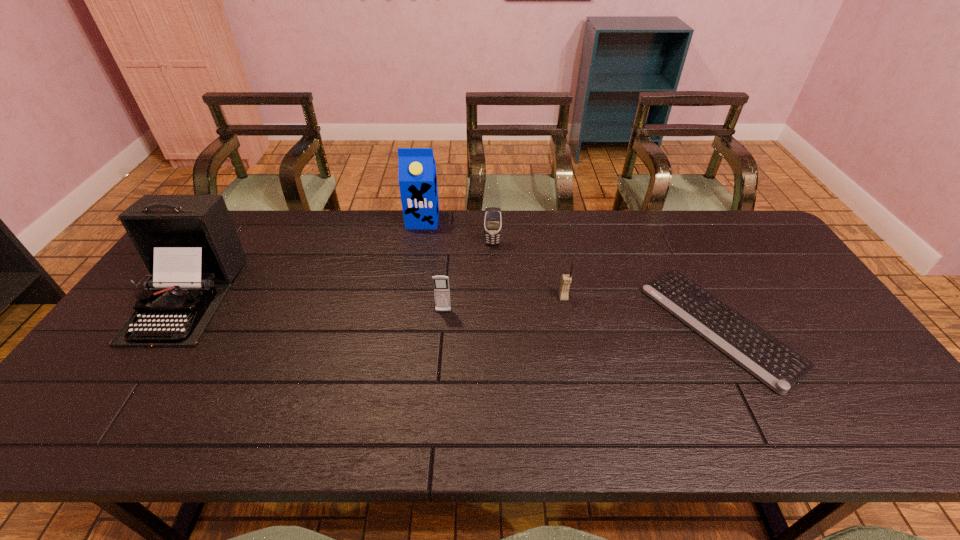
Locate an element on the screen. The height and width of the screenshot is (540, 960). the rightmost object is located at coordinates click(x=778, y=366).

What are the coordinates of `vacant space situated with the cap open on the farthest object` in the screenshot? It's located at (418, 252).

Identify the location of free space located inside the open case of the typewriter. (111, 408).

Identify the location of free space located on the front-facing side of the nearest cellular telephone. Image resolution: width=960 pixels, height=540 pixels. (442, 331).

The image size is (960, 540). Find the location of `vacant area situated on the front face of the farthest cellular telephone`. vacant area situated on the front face of the farthest cellular telephone is located at coordinates (494, 307).

You are a GUI agent. You are given a task and a screenshot of the screen. Output one action in this format:
    pyautogui.click(x=<x>, y=<y>)
    Task: Click on the vacant space located 0.130m on the front of the second farthest cellular telephone, where the keypad is located
    This screenshot has width=960, height=540.
    Given the screenshot: What is the action you would take?
    pyautogui.click(x=571, y=337)

Where is `vacant area located 0.060m on the back of the rightmost object`? vacant area located 0.060m on the back of the rightmost object is located at coordinates (685, 260).

The width and height of the screenshot is (960, 540). Identify the location of carton at the far edge. (417, 169).

What are the coordinates of `cellular telephone that is at the far edge` in the screenshot? It's located at (492, 216).

Image resolution: width=960 pixels, height=540 pixels. Identify the location of object that is at the left edge. tap(189, 244).